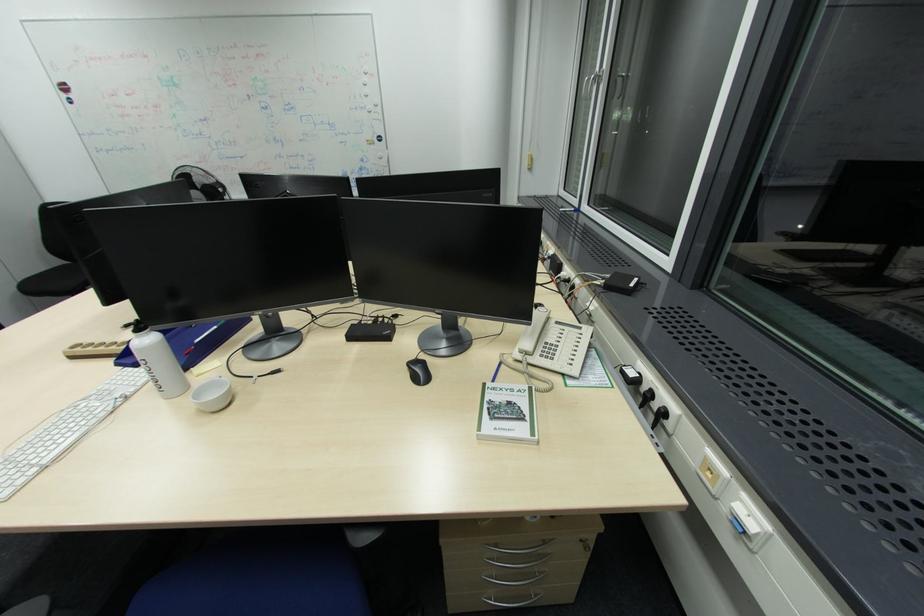
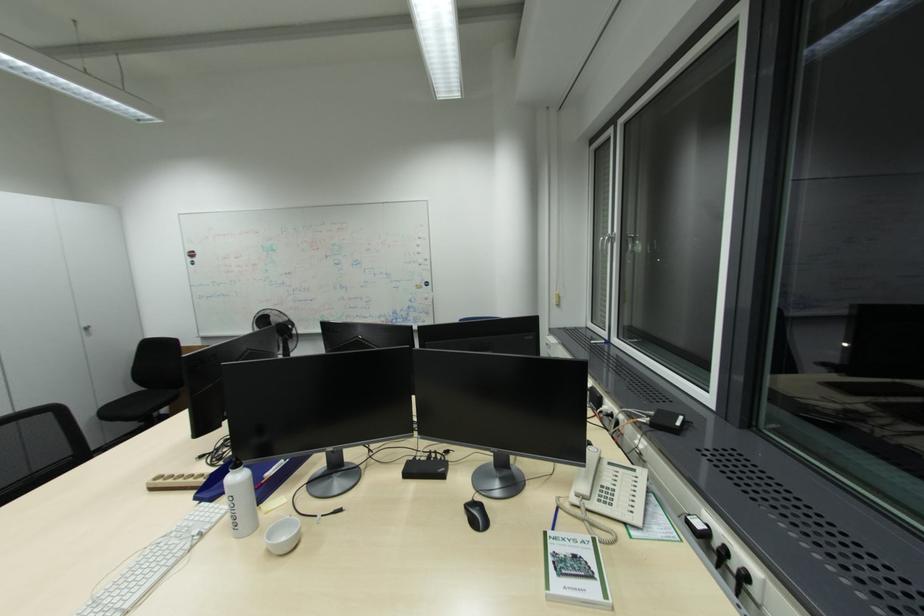
Question: The first image is from the beginning of the video and the second image is from the end. How did the camera likely rotate when shooting the video?

Choices:
 (A) Left
 (B) Right
 (C) Up
 (D) Down

Answer: (C)